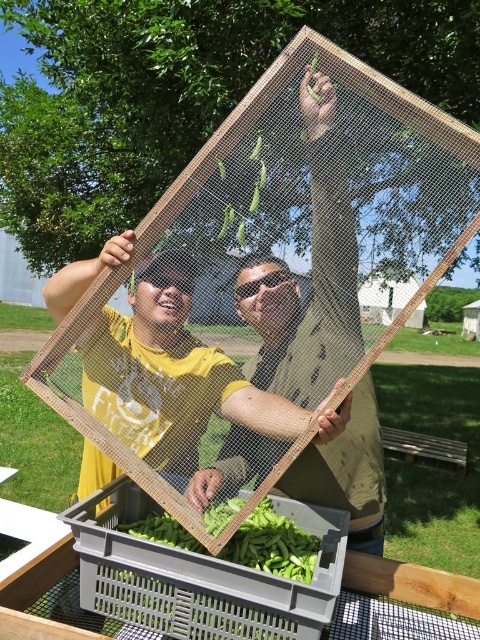
How far apart are wooden frame at center and matte yellow shirt at center?

The distance of wooden frame at center from matte yellow shirt at center is 11.19 inches.

Looking at this image, does wooden frame at center appear under matte yellow shirt at center?

Indeed, wooden frame at center is positioned under matte yellow shirt at center.

Which is in front, point (338, 276) or point (84, 454)?

Point (338, 276)

Locate an element on the screen. The height and width of the screenshot is (640, 480). wooden frame at center is located at coordinates (311, 275).

The height and width of the screenshot is (640, 480). Describe the element at coordinates (165, 323) in the screenshot. I see `matte yellow shirt at center` at that location.

From the picture: Is matte yellow shirt at center shorter than green matte beans at center?

Incorrect, matte yellow shirt at center's height does not fall short of green matte beans at center's.

Is point (145, 356) farther from viewer compared to point (284, 525)?

Yes, point (145, 356) is behind point (284, 525).

Where is `matte yellow shirt at center`? matte yellow shirt at center is located at coordinates (165, 323).

Who is taller, wooden frame at center or green matte beans at center?

wooden frame at center is taller.

Does point (321, 250) come behind point (296, 564)?

Yes, point (321, 250) is behind point (296, 564).

Between point (320, 218) and point (261, 536), which one is positioned in front?

Point (261, 536)

At what (x,y) coordinates should I click in order to perform the action: click on wooden frame at center. Please return your answer as a coordinate pair (x, y). The image size is (480, 640). Looking at the image, I should click on (311, 275).